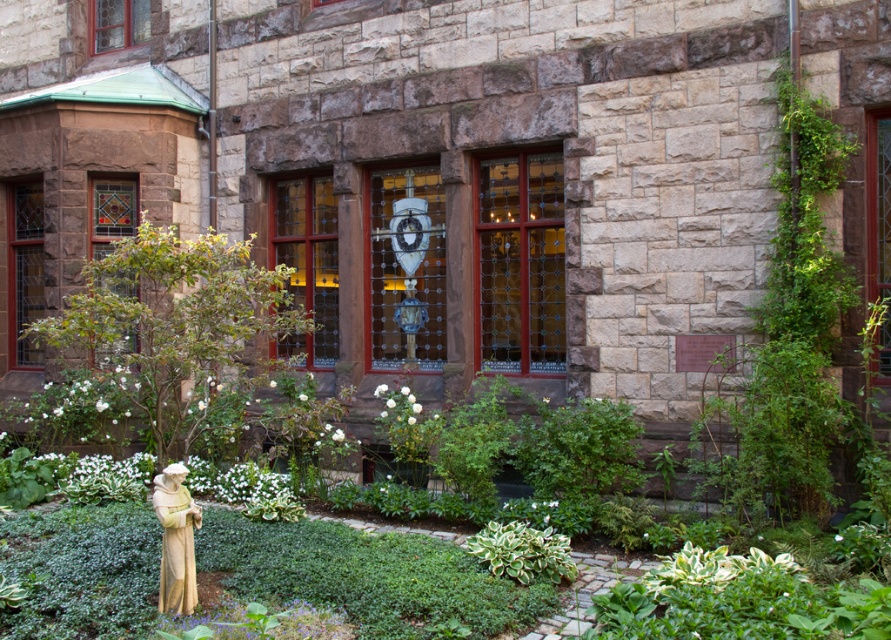
In the scene shown: You are standing at the entrance of the stone building and want to find the stone statue at lower left. According to the coordinates provided, where should you look relative to your current position?

The stone statue at lower left is located at coordinates 0.844 on the x axis and 0.198 on the y axis relative to your current position at the entrance of the stone building.

You are standing in the garden in front of the stone building and see two points marked in the image. Which point, point (199, 515) or point (544, 534), is closer to you?

Point (199, 515) is closer to the viewer than point (544, 534).

You are a gardener planning to transplant the green leafy bush at lower left and the variegated leafy plant at center to a new garden bed. Which of the two plants requires a larger space due to its size?

The green leafy bush at lower left requires a larger space because it is bigger than the variegated leafy plant at center.